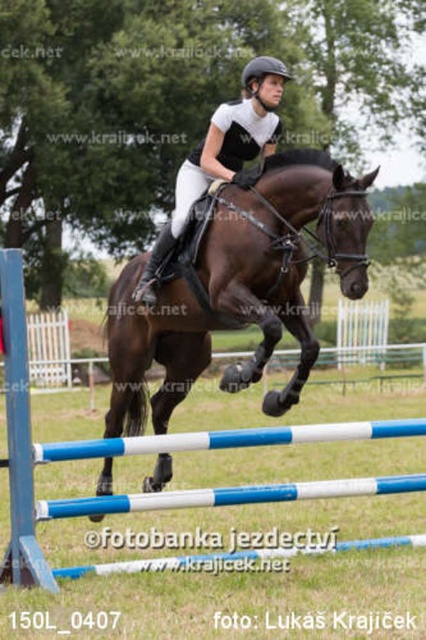
Question: Which object is farther from the camera taking this photo?

Choices:
 (A) blue/white plastic hurdle at center
 (B) shiny brown horse at center

Answer: (B)

Question: From the image, what is the correct spatial relationship of shiny brown horse at center in relation to blue/white plastic hurdle at center?

Choices:
 (A) left
 (B) right

Answer: (B)

Question: Can you confirm if shiny brown horse at center is bigger than blue/white plastic hurdle at center?

Choices:
 (A) no
 (B) yes

Answer: (B)

Question: In this image, where is shiny brown horse at center located relative to blue/white plastic hurdle at center?

Choices:
 (A) below
 (B) above

Answer: (B)